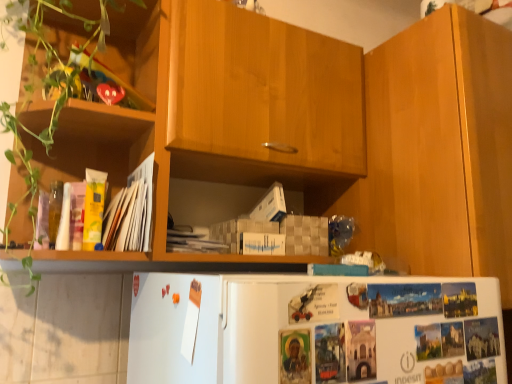
Question: Is green matte plant at left located within yellow paper at left?

Choices:
 (A) no
 (B) yes

Answer: (A)

Question: Does yellow paper at left have a greater height compared to green matte plant at left?

Choices:
 (A) no
 (B) yes

Answer: (A)

Question: From the image's perspective, is yellow paper at left beneath green matte plant at left?

Choices:
 (A) no
 (B) yes

Answer: (B)

Question: Is yellow paper at left aimed at green matte plant at left?

Choices:
 (A) yes
 (B) no

Answer: (B)

Question: Is the depth of yellow paper at left greater than that of green matte plant at left?

Choices:
 (A) yes
 (B) no

Answer: (A)

Question: From the image's perspective, is yellow paper at left on green matte plant at left?

Choices:
 (A) no
 (B) yes

Answer: (A)

Question: Is green matte plant at left in contact with wooden cabinet at right?

Choices:
 (A) yes
 (B) no

Answer: (B)

Question: Can you confirm if green matte plant at left is smaller than wooden cabinet at right?

Choices:
 (A) yes
 (B) no

Answer: (A)

Question: From the image's perspective, would you say green matte plant at left is positioned over wooden cabinet at right?

Choices:
 (A) no
 (B) yes

Answer: (B)

Question: Considering the relative sizes of green matte plant at left and wooden cabinet at right in the image provided, is green matte plant at left wider than wooden cabinet at right?

Choices:
 (A) yes
 (B) no

Answer: (B)

Question: Is the depth of green matte plant at left less than that of wooden cabinet at right?

Choices:
 (A) no
 (B) yes

Answer: (B)

Question: Can you confirm if green matte plant at left is shorter than wooden cabinet at right?

Choices:
 (A) yes
 (B) no

Answer: (B)

Question: From a real-world perspective, is green matte plant at left positioned over yellow paper at left based on gravity?

Choices:
 (A) yes
 (B) no

Answer: (A)